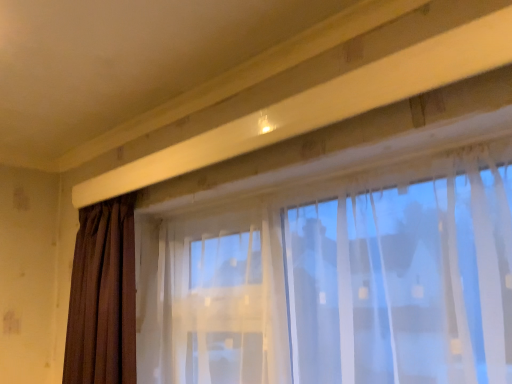
The height and width of the screenshot is (384, 512). In order to click on brown textured curtain at left in this screenshot , I will do `click(103, 296)`.

Describe the element at coordinates (103, 296) in the screenshot. I see `brown textured curtain at left` at that location.

The image size is (512, 384). Find the location of `brown textured curtain at left`. brown textured curtain at left is located at coordinates (103, 296).